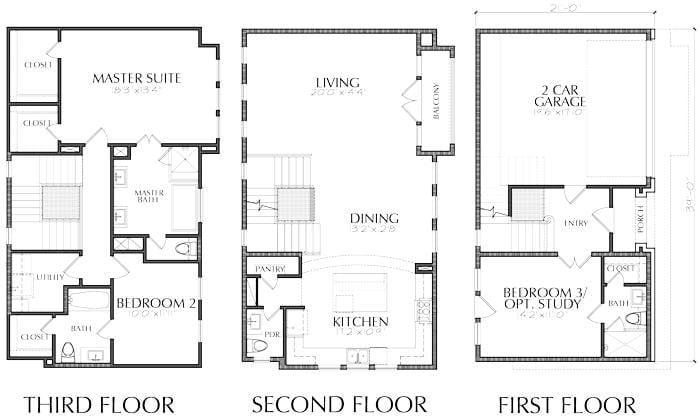
At what (x,y) coordinates should I click in order to perform the action: click on closets. Please return your answer as a coordinate pair (x, y). The height and width of the screenshot is (417, 700). Looking at the image, I should click on (36, 62), (32, 121), (29, 338), (634, 269).